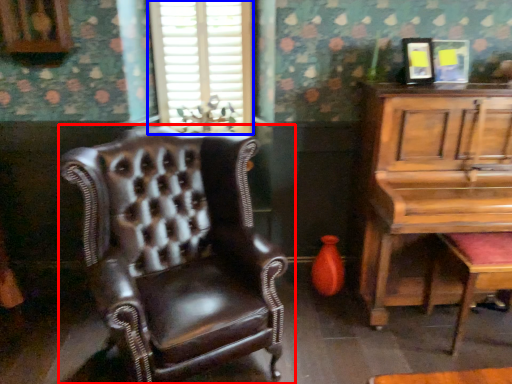
Question: Which object is closer to the camera taking this photo, chair (highlighted by a red box) or window (highlighted by a blue box)?

Choices:
 (A) chair
 (B) window

Answer: (A)